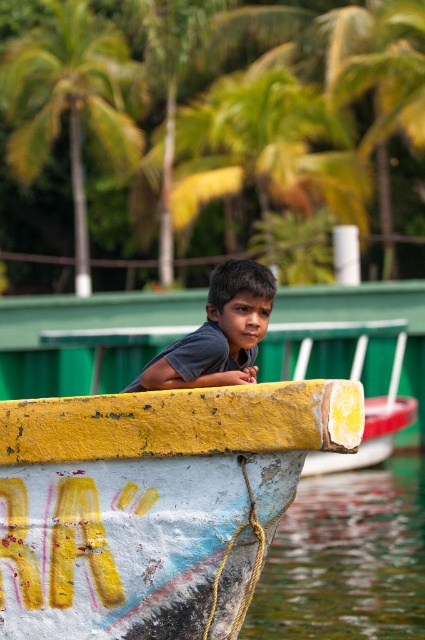
Is point (291, 598) behind point (25, 76)?

No, (291, 598) is closer to viewer.

From the picture: Can you confirm if transparent water at lower left is positioned to the right of green leafy palm tree at upper left?

Indeed, transparent water at lower left is positioned on the right side of green leafy palm tree at upper left.

Who is more forward, (260, 593) or (110, 144)?

Positioned in front is point (260, 593).

You are a GUI agent. You are given a task and a screenshot of the screen. Output one action in this format:
    pyautogui.click(x=<x>, y=<y>)
    Task: Click on the transparent water at lower left
    
    Given the screenshot: What is the action you would take?
    pyautogui.click(x=346, y=560)

Is yellow painted wood boat at center taller than green leafy palm tree at upper left?

Incorrect, yellow painted wood boat at center's height is not larger of green leafy palm tree at upper left's.

Which is above, yellow painted wood boat at center or green leafy palm tree at upper left?

green leafy palm tree at upper left is higher up.

Is point (254, 561) positioned in front of point (84, 256)?

Yes.

Locate an element on the screen. yellow painted wood boat at center is located at coordinates (150, 502).

Which is below, yellow painted wood boat at center or yellow painted letters at boat front?

yellow painted letters at boat front is below.

Is yellow painted wood boat at center positioned at the back of yellow painted letters at boat front?

No, yellow painted wood boat at center is closer to the viewer.

The width and height of the screenshot is (425, 640). I want to click on yellow painted wood boat at center, so click(150, 502).